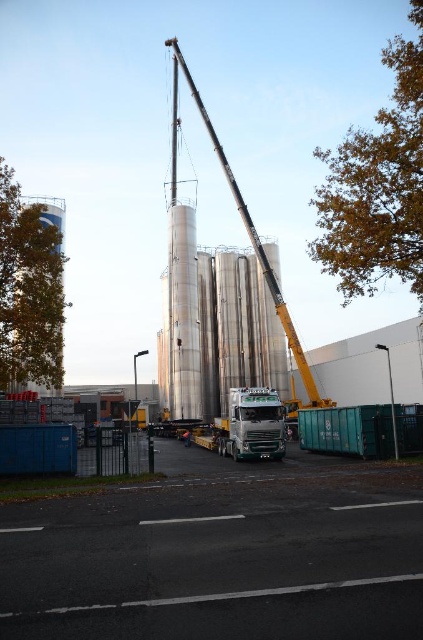
Can you confirm if green metallic truck at center is positioned to the right of metallic silver crane at center?

Yes, green metallic truck at center is to the right of metallic silver crane at center.

From the picture: Who is more forward, (235, 449) or (299, 401)?

Point (235, 449) is more forward.

Where is `green metallic truck at center`? green metallic truck at center is located at coordinates (252, 424).

Is point (235, 392) positioned in front of point (63, 244)?

Yes.

Does green metallic truck at center have a smaller size compared to brushed metal silo at left?

Yes, green metallic truck at center is smaller than brushed metal silo at left.

The height and width of the screenshot is (640, 423). What are the coordinates of `green metallic truck at center` in the screenshot? It's located at (252, 424).

Locate an element on the screen. The width and height of the screenshot is (423, 640). green metallic truck at center is located at coordinates (252, 424).

Is metallic silver crane at center in front of brushed metal silo at left?

That is False.

Can you confirm if metallic silver crane at center is positioned to the right of brushed metal silo at left?

Yes, metallic silver crane at center is to the right of brushed metal silo at left.

Describe the element at coordinates (260, 260) in the screenshot. I see `metallic silver crane at center` at that location.

Where is `metallic silver crane at center`? metallic silver crane at center is located at coordinates (260, 260).